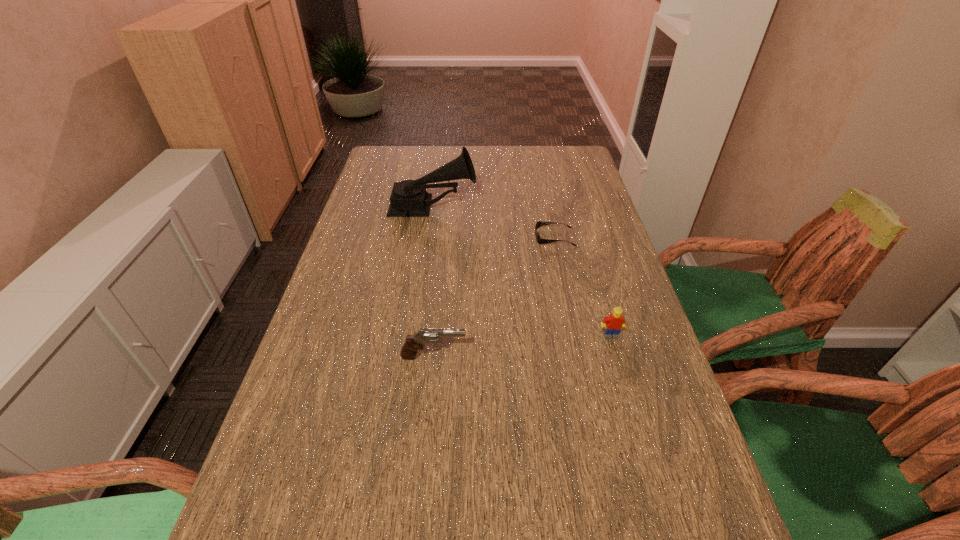
Where is `vacant space located 0.250m on the front-facing side of the second farthest object`? vacant space located 0.250m on the front-facing side of the second farthest object is located at coordinates (449, 237).

You are a GUI agent. You are given a task and a screenshot of the screen. Output one action in this format:
    pyautogui.click(x=<x>, y=<y>)
    Task: Click on the free space located on the front-facing side of the second farthest object
    The width and height of the screenshot is (960, 540).
    Given the screenshot: What is the action you would take?
    pyautogui.click(x=480, y=237)

The image size is (960, 540). I want to click on object positioned at the left edge, so click(409, 198).

Identify the location of Lego that is at the right edge. (615, 322).

Find the location of a particular element. This screenshot has width=960, height=540. sunglasses that is at the right edge is located at coordinates (540, 241).

This screenshot has width=960, height=540. I want to click on vacant space at the far edge of the desktop, so click(x=534, y=163).

At what (x,y) coordinates should I click in order to perform the action: click on free space at the left edge of the desktop. Please return your answer as a coordinate pair (x, y). The image size is (960, 540). Looking at the image, I should click on (334, 323).

The width and height of the screenshot is (960, 540). Identify the location of free space at the right edge. (610, 458).

The width and height of the screenshot is (960, 540). I want to click on vacant area at the far right corner of the desktop, so click(569, 152).

Locate an element on the screen. empty space that is in between the sunglasses and the tallest object is located at coordinates tap(493, 222).